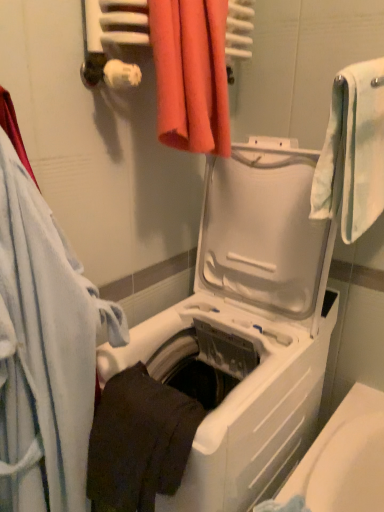
Question: Can you confirm if orange fabric towel at upper center, the third towel in the left-to-right sequence, is positioned to the right of dark matte towel at lower center, which is counted as the third towel, starting from the right?

Choices:
 (A) no
 (B) yes

Answer: (B)

Question: Does orange fabric towel at upper center, the third towel in the left-to-right sequence, have a greater height compared to dark matte towel at lower center, which is counted as the third towel, starting from the right?

Choices:
 (A) no
 (B) yes

Answer: (B)

Question: Considering the relative sizes of orange fabric towel at upper center, the third towel in the left-to-right sequence, and dark matte towel at lower center, arranged as the second towel when viewed from the left, in the image provided, is orange fabric towel at upper center, the third towel in the left-to-right sequence, wider than dark matte towel at lower center, arranged as the second towel when viewed from the left,?

Choices:
 (A) yes
 (B) no

Answer: (B)

Question: From a real-world perspective, is orange fabric towel at upper center, the 2th towel when ordered from right to left, on dark matte towel at lower center, arranged as the second towel when viewed from the left?

Choices:
 (A) no
 (B) yes

Answer: (B)

Question: Is orange fabric towel at upper center, the 2th towel when ordered from right to left, touching dark matte towel at lower center, arranged as the second towel when viewed from the left?

Choices:
 (A) no
 (B) yes

Answer: (A)

Question: Can you confirm if orange fabric towel at upper center, the third towel in the left-to-right sequence, is bigger than dark matte towel at lower center, arranged as the second towel when viewed from the left?

Choices:
 (A) no
 (B) yes

Answer: (A)

Question: Is the depth of dark matte towel at lower center, arranged as the second towel when viewed from the left, less than that of white plastic washing machine at center?

Choices:
 (A) no
 (B) yes

Answer: (A)

Question: From a real-world perspective, is dark matte towel at lower center, which is counted as the third towel, starting from the right, positioned under white plastic washing machine at center based on gravity?

Choices:
 (A) no
 (B) yes

Answer: (A)

Question: From the image's perspective, is dark matte towel at lower center, arranged as the second towel when viewed from the left, on white plastic washing machine at center?

Choices:
 (A) yes
 (B) no

Answer: (B)

Question: Can you see dark matte towel at lower center, which is counted as the third towel, starting from the right, touching white plastic washing machine at center?

Choices:
 (A) no
 (B) yes

Answer: (A)

Question: Is dark matte towel at lower center, arranged as the second towel when viewed from the left, facing away from white plastic washing machine at center?

Choices:
 (A) no
 (B) yes

Answer: (B)

Question: From the image's perspective, would you say dark matte towel at lower center, arranged as the second towel when viewed from the left, is shown under white plastic washing machine at center?

Choices:
 (A) no
 (B) yes

Answer: (B)

Question: Are dark matte towel at lower center, which is counted as the third towel, starting from the right, and orange fabric towel at upper center, the 2th towel when ordered from right to left, located far from each other?

Choices:
 (A) no
 (B) yes

Answer: (A)